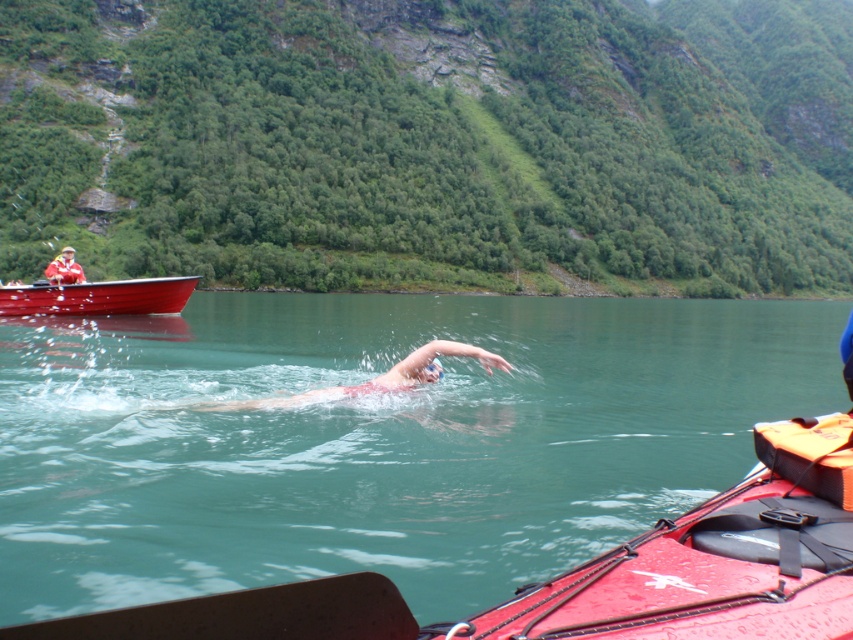
You are a photographer trying to capture the swimmer in the center. You need to adjust your camera to focus on the green smooth water at center. What are the coordinates you should set your camera to focus on?

The coordinates to focus on the green smooth water at center are at point (376, 440).

You are standing at the point labeled point (431, 360) and want to move towards the point labeled point (57, 280). Given that you can only move forward in a straight line, will you get closer to or farther from the camera as you move?

Since point (431, 360) is closer to the camera than point (57, 280), moving towards the latter will take you farther away from the camera.

You are a photographer trying to capture a photo of the skinny swimmer at center and the matte red jacket at upper left. Which object is located to the right of the other?

The skinny swimmer at center is positioned on the right side of matte red jacket at upper left.